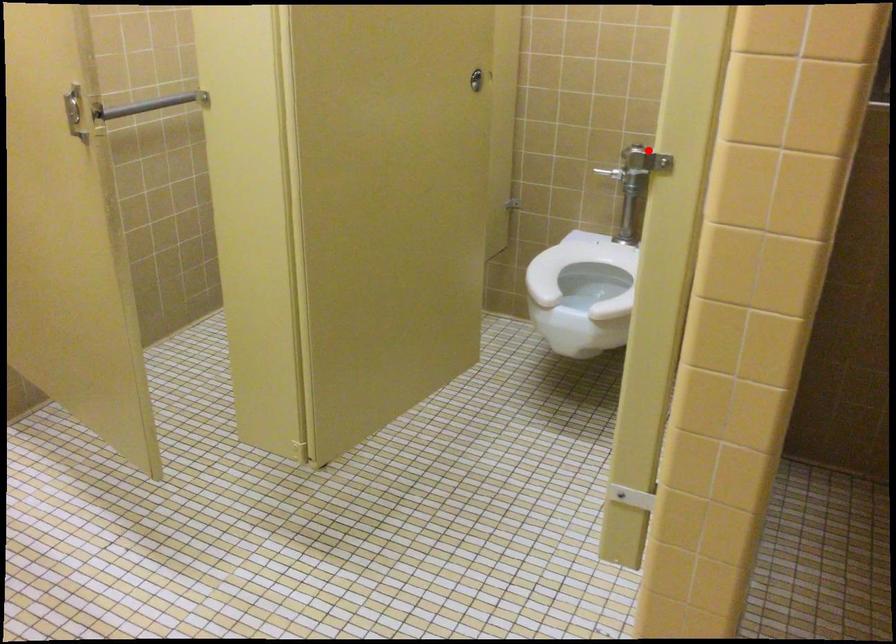
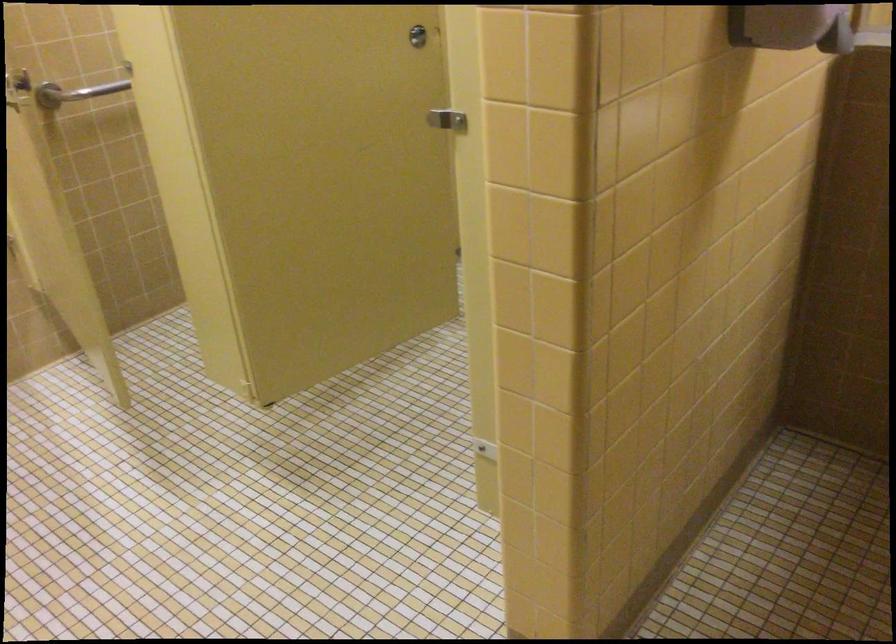
In the second image, find the point that corresponds to the highlighted location in the first image.

(446, 120)